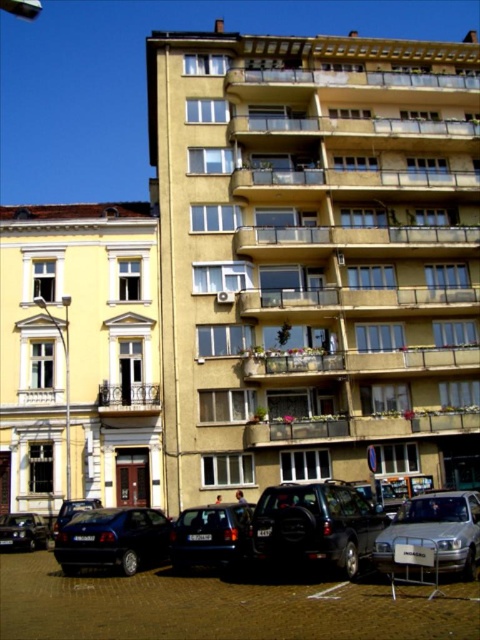
Question: Is shiny dark blue sedan at lower left above metallic silver car at lower left?

Choices:
 (A) no
 (B) yes

Answer: (B)

Question: Does shiny black suv at center appear on the right side of shiny black car at lower left?

Choices:
 (A) yes
 (B) no

Answer: (A)

Question: Estimate the real-world distances between objects in this image. Which object is closer to the shiny black suv at center?

Choices:
 (A) silver metallic car at lower right
 (B) shiny black car at lower left
 (C) metallic silver car at lower left

Answer: (A)

Question: Can you confirm if shiny dark blue sedan at lower left is bigger than metallic silver car at lower left?

Choices:
 (A) yes
 (B) no

Answer: (A)

Question: Which object appears closest to the camera in this image?

Choices:
 (A) shiny black car at lower left
 (B) shiny dark blue sedan at lower left
 (C) shiny black car at lower center
 (D) silver metallic car at lower right

Answer: (D)

Question: Estimate the real-world distances between objects in this image. Which object is closer to the silver metallic car at lower right?

Choices:
 (A) metallic silver car at lower left
 (B) shiny black suv at center

Answer: (B)